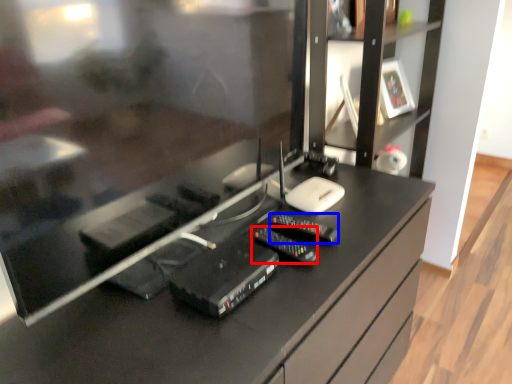
Question: Which of the following is the closest to the observer, equipment (highlighted by a red box) or control (highlighted by a blue box)?

Choices:
 (A) equipment
 (B) control

Answer: (A)